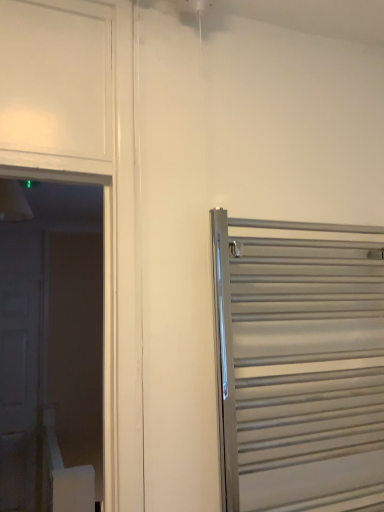
Question: From a real-world perspective, is white matte door at left, positioned as the 1th door in left-to-right order, below satin silver towel rack at right, which is the first door in front-to-back order?

Choices:
 (A) yes
 (B) no

Answer: (A)

Question: Is white matte door at left, the 1th door viewed from the back, far away from satin silver towel rack at right, arranged as the second door when viewed from the back?

Choices:
 (A) no
 (B) yes

Answer: (B)

Question: Is white matte door at left, the 1th door viewed from the back, facing towards satin silver towel rack at right, which is the first door in front-to-back order?

Choices:
 (A) yes
 (B) no

Answer: (B)

Question: From a real-world perspective, is white matte door at left, positioned as the 1th door in left-to-right order, over satin silver towel rack at right, which is the first door in front-to-back order?

Choices:
 (A) yes
 (B) no

Answer: (B)

Question: From the image's perspective, does white matte door at left, the second door positioned from the front, appear lower than satin silver towel rack at right, arranged as the second door when viewed from the back?

Choices:
 (A) no
 (B) yes

Answer: (B)

Question: Is white matte door at left, positioned as the 1th door in left-to-right order, thinner than satin silver towel rack at right, arranged as the 2th door when viewed from the left?

Choices:
 (A) no
 (B) yes

Answer: (B)

Question: From a real-world perspective, is satin silver towel rack at right, arranged as the 2th door when viewed from the left, physically below white matte door at left, the 1th door viewed from the back?

Choices:
 (A) yes
 (B) no

Answer: (B)

Question: Considering the relative sizes of satin silver towel rack at right, marked as the 1th door in a right-to-left arrangement, and white matte door at left, the second door positioned from the front, in the image provided, is satin silver towel rack at right, marked as the 1th door in a right-to-left arrangement, smaller than white matte door at left, the second door positioned from the front,?

Choices:
 (A) no
 (B) yes

Answer: (B)

Question: Is satin silver towel rack at right, arranged as the second door when viewed from the back, outside of white matte door at left, the second door positioned from the front?

Choices:
 (A) yes
 (B) no

Answer: (A)

Question: Is satin silver towel rack at right, arranged as the 2th door when viewed from the left, taller than white matte door at left, the 1th door viewed from the back?

Choices:
 (A) yes
 (B) no

Answer: (B)

Question: Does satin silver towel rack at right, arranged as the second door when viewed from the back, come behind white matte door at left, the 2th door from the right?

Choices:
 (A) no
 (B) yes

Answer: (A)

Question: Is white matte door at left, the second door positioned from the front, a part of satin silver towel rack at right, marked as the 1th door in a right-to-left arrangement?

Choices:
 (A) no
 (B) yes

Answer: (A)

Question: Relative to white matte door at left, the 2th door from the right, is satin silver towel rack at right, arranged as the second door when viewed from the back, in front or behind?

Choices:
 (A) front
 (B) behind

Answer: (A)